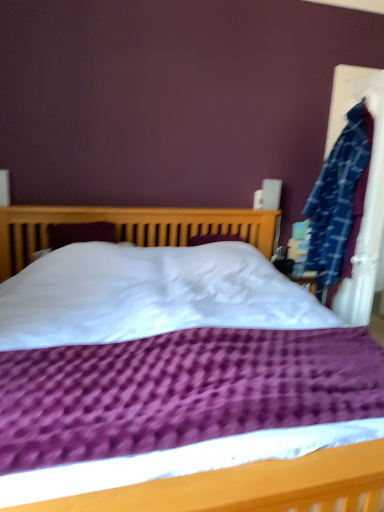
What is the approximate width of purple quilted bed at center?

The width of purple quilted bed at center is 2.35 meters.

This screenshot has height=512, width=384. I want to click on purple quilted bed at center, so click(250, 486).

Image resolution: width=384 pixels, height=512 pixels. What do you see at coordinates (250, 486) in the screenshot?
I see `purple quilted bed at center` at bounding box center [250, 486].

Locate an element on the screen. This screenshot has height=512, width=384. purple quilted bed at center is located at coordinates (250, 486).